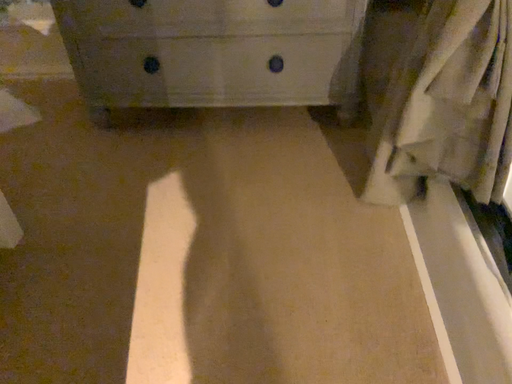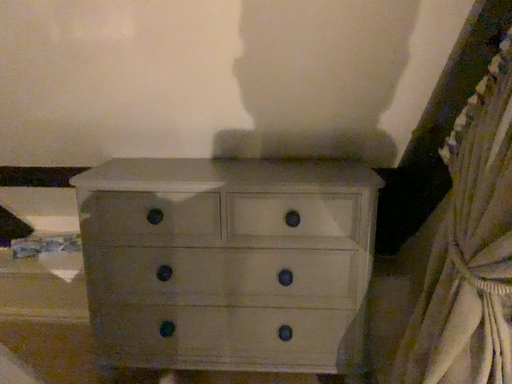
Question: How did the camera likely rotate when shooting the video?

Choices:
 (A) rotated downward
 (B) rotated upward

Answer: (B)